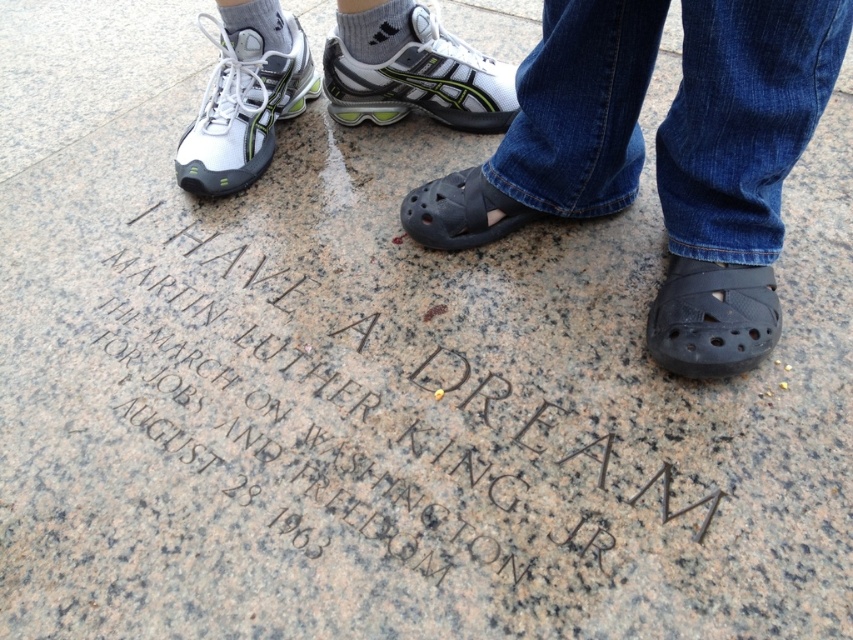
Question: Which of the following is the farthest from the observer?

Choices:
 (A) (230, 141)
 (B) (416, 502)

Answer: (A)

Question: Does granite engraving at center have a lesser width compared to black rubber sandal at lower right?

Choices:
 (A) no
 (B) yes

Answer: (A)

Question: Among these points, which one is farthest from the camera?

Choices:
 (A) click(x=247, y=157)
 (B) click(x=744, y=234)
 (C) click(x=352, y=445)
 (D) click(x=402, y=68)

Answer: (D)

Question: Is white mesh shoe at center positioned behind black rubber sandal at lower right?

Choices:
 (A) yes
 (B) no

Answer: (A)

Question: Based on their relative distances, which object is farther from the white mesh sneakers at left?

Choices:
 (A) black rubber sandals at lower center
 (B) granite engraving at center
 (C) black rubber sandal at lower right
 (D) black rubber sandal at center

Answer: (C)

Question: Is white mesh sneakers at left positioned at the back of black rubber sandal at lower right?

Choices:
 (A) yes
 (B) no

Answer: (A)